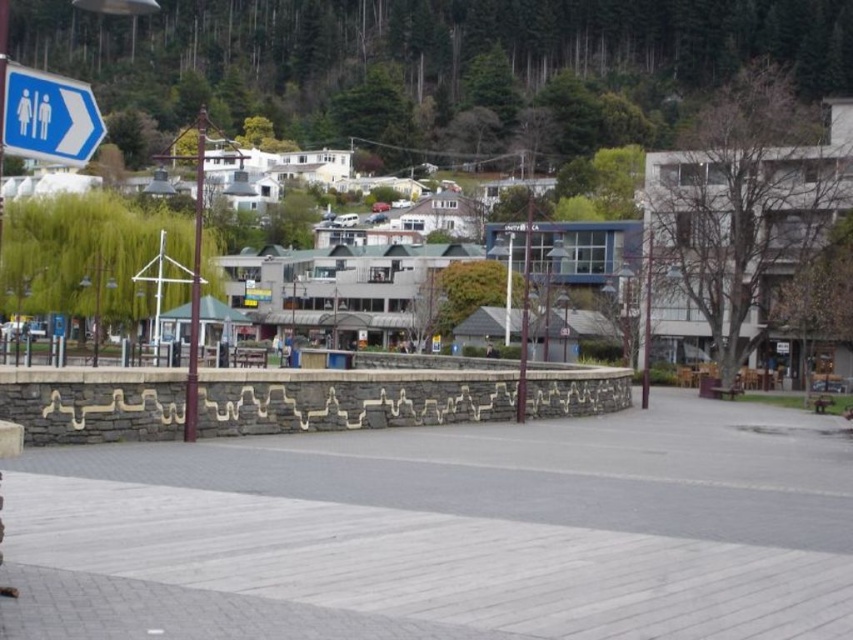
Question: Is gray concrete pavement at center bigger than blue plastic sign at upper left?

Choices:
 (A) yes
 (B) no

Answer: (A)

Question: Is the position of gray concrete pavement at center more distant than that of blue plastic sign at upper left?

Choices:
 (A) yes
 (B) no

Answer: (A)

Question: Which object appears closest to the camera in this image?

Choices:
 (A) gray concrete pavement at center
 (B) blue plastic sign at upper left

Answer: (B)

Question: Is gray concrete pavement at center thinner than blue plastic sign at upper left?

Choices:
 (A) no
 (B) yes

Answer: (A)